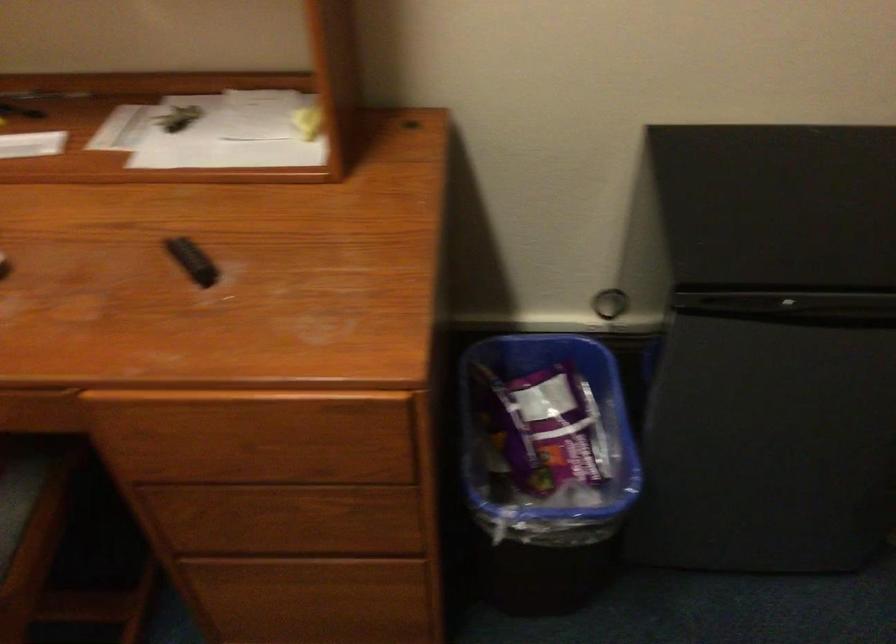
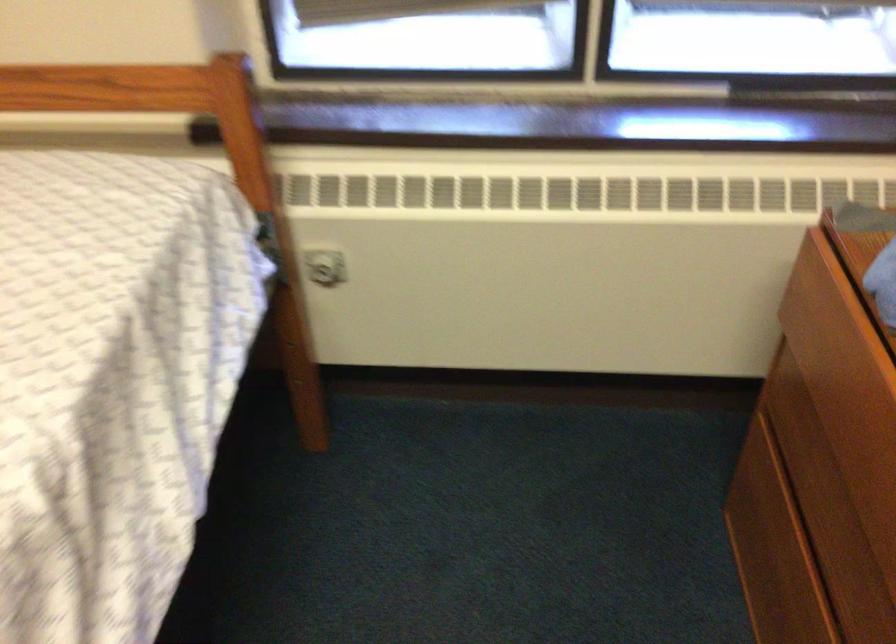
The images are taken continuously from a first-person perspective. In which direction is your viewpoint rotating?

The rotation direction of the camera is left-down.